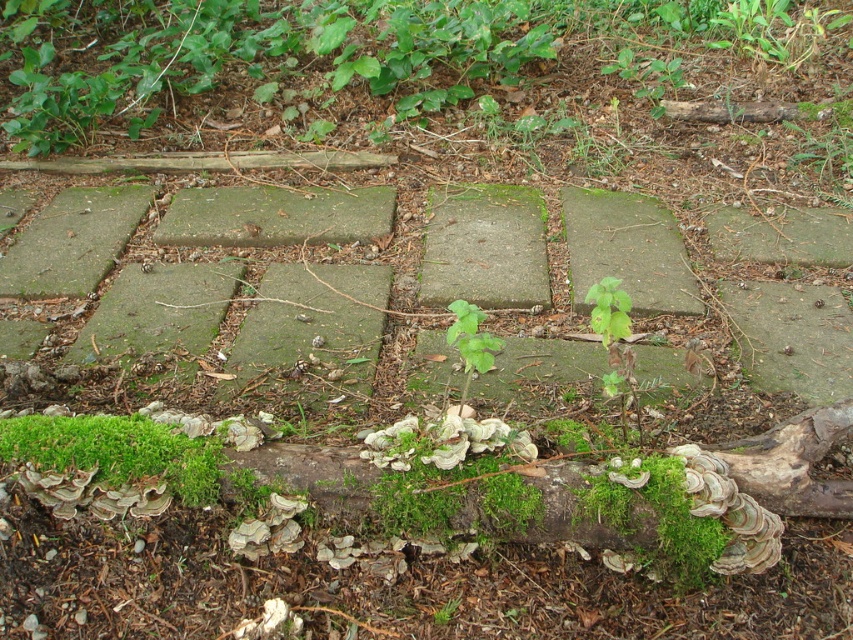
You are a nature photographer aiming to capture both the green mossy log at upper center and the green mossy log at lower left in a single frame. Based on their positions, which log should you focus on first to ensure both are in the shot?

You should focus on the green mossy log at lower left first because it is positioned to the left of the green mossy log at upper center, allowing you to frame both logs by starting from the left and expanding the view to the right.

You are a gardener assessing the stability of the logs in the scene. Which log, the green mossy log at upper center or the green mossy log at lower left, is more likely to be stable due to its size?

The green mossy log at upper center is bigger than the green mossy log at lower left, making it more stable.